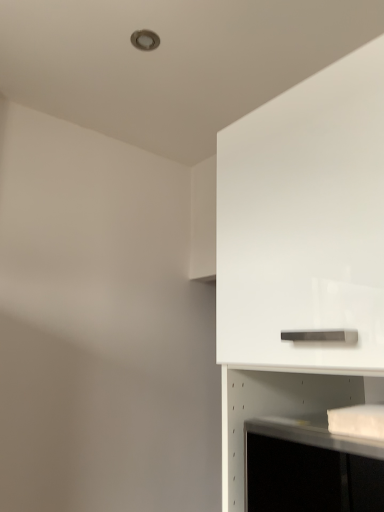
Question: Is white glossy shelf at lower right to the left or to the right of white glossy cabinet at upper right in the image?

Choices:
 (A) right
 (B) left

Answer: (B)

Question: Based on their sizes in the image, would you say white glossy shelf at lower right is bigger or smaller than white glossy cabinet at upper right?

Choices:
 (A) big
 (B) small

Answer: (B)

Question: Is white glossy shelf at lower right wider or thinner than white glossy cabinet at upper right?

Choices:
 (A) wide
 (B) thin

Answer: (B)

Question: Which is correct: white glossy cabinet at upper right is inside white glossy shelf at lower right, or outside of it?

Choices:
 (A) inside
 (B) outside

Answer: (B)

Question: Is white glossy cabinet at upper right taller or shorter than white glossy shelf at lower right?

Choices:
 (A) tall
 (B) short

Answer: (A)

Question: Relative to white glossy shelf at lower right, is white glossy cabinet at upper right in front or behind?

Choices:
 (A) behind
 (B) front

Answer: (B)

Question: Considering the positions of white glossy cabinet at upper right and white glossy shelf at lower right in the image, is white glossy cabinet at upper right bigger or smaller than white glossy shelf at lower right?

Choices:
 (A) small
 (B) big

Answer: (B)